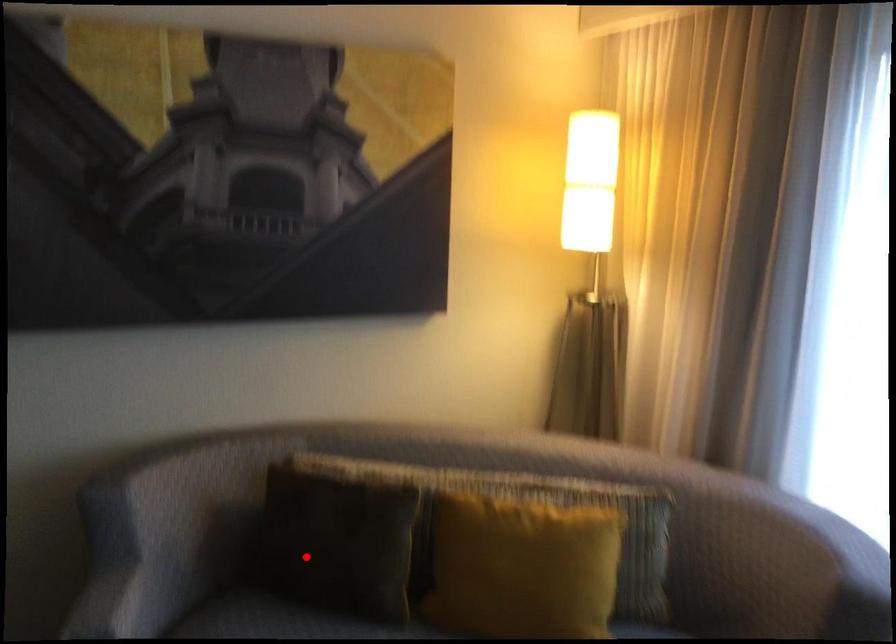
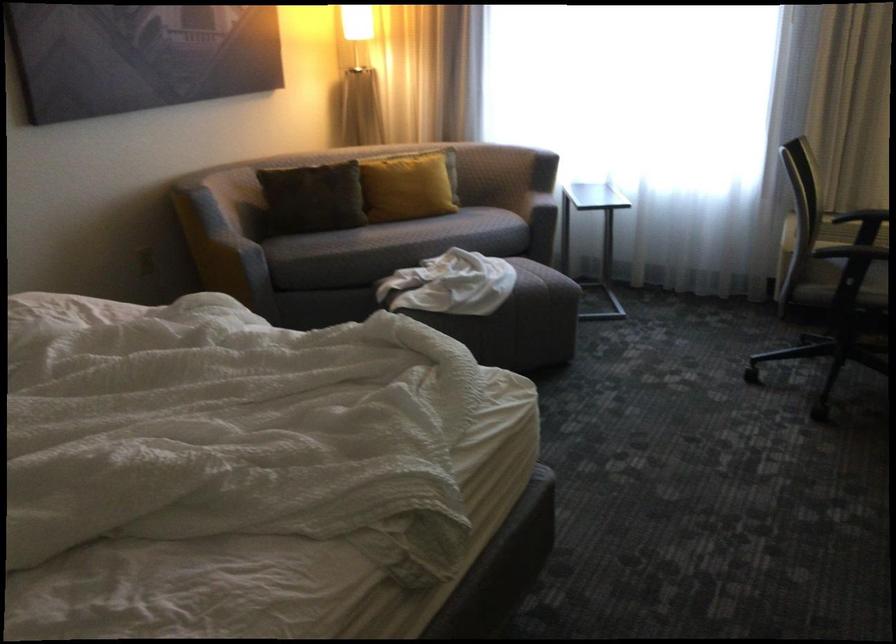
Question: I am providing you with two images of the same scene from different viewpoints. A red point is shown in image1. For the corresponding object point in image2, is it positioned nearer or farther from the camera?

Choices:
 (A) Nearer
 (B) Farther

Answer: (B)